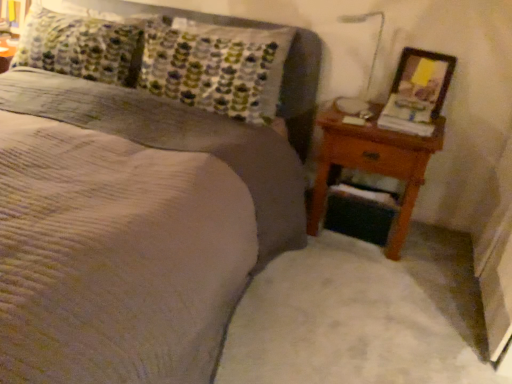
Question: From the image's perspective, is brown wooden nightstand at right above or below textured gray bed at center?

Choices:
 (A) below
 (B) above

Answer: (A)

Question: In the image, is brown wooden nightstand at right positioned in front of or behind textured gray bed at center?

Choices:
 (A) behind
 (B) front

Answer: (A)

Question: Which object is the farthest from the brown wooden nightstand at right?

Choices:
 (A) wooden picture frame at right
 (B) textured gray bed at center

Answer: (B)

Question: Which object is the closest to the brown wooden nightstand at right?

Choices:
 (A) textured gray bed at center
 (B) wooden picture frame at right

Answer: (B)